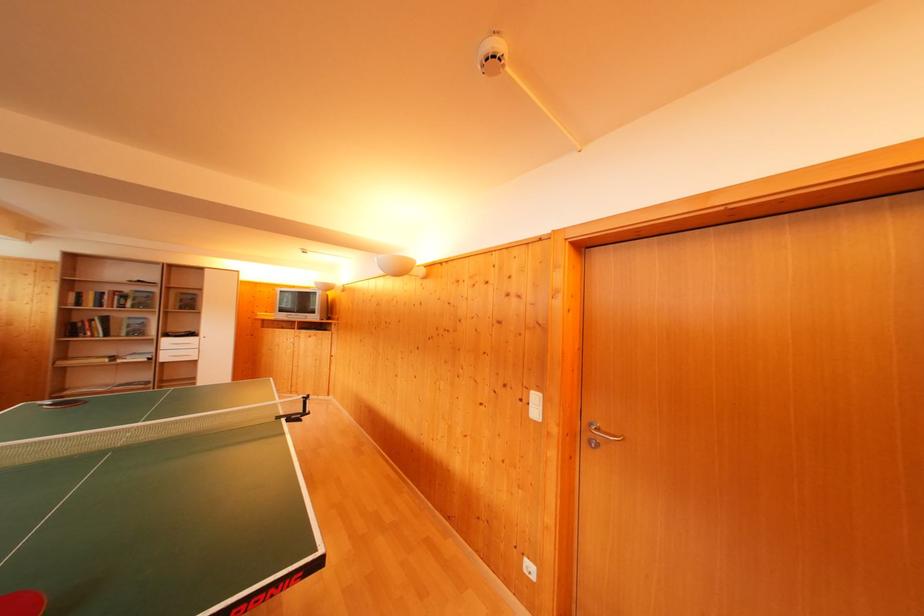
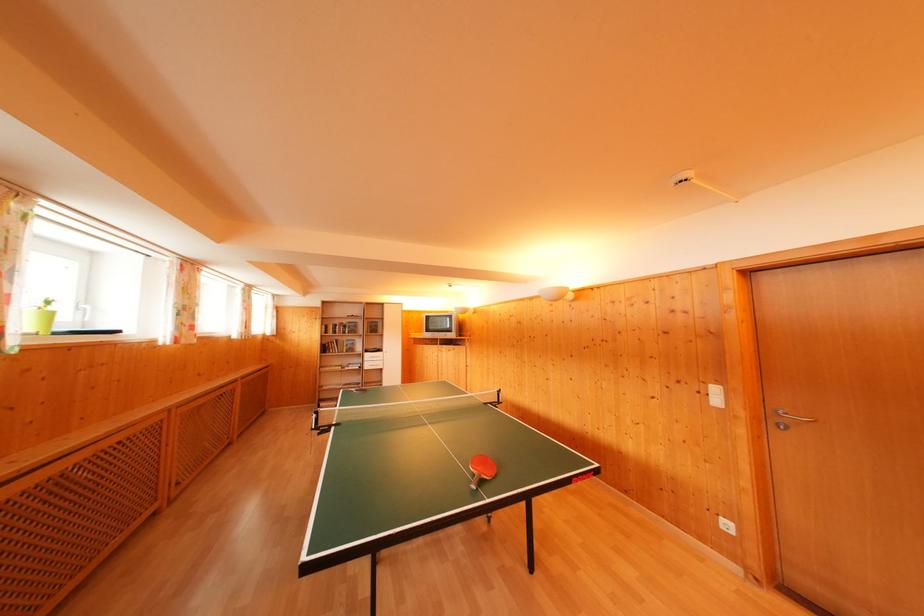
Locate, in the second image, the point that corresponds to the point at 172,346 in the first image.

(371, 360)